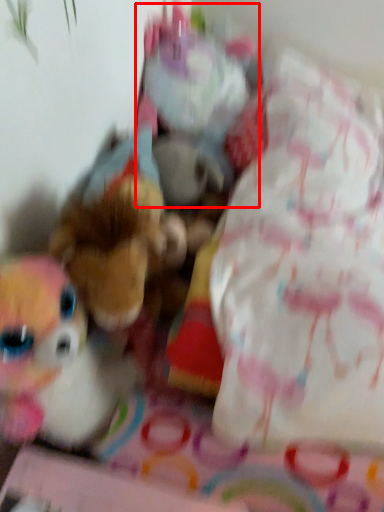
Question: From the image's perspective, considering the relative positions of toy (annotated by the red box) and toy in the image provided, where is toy (annotated by the red box) located with respect to the staircase?

Choices:
 (A) above
 (B) below

Answer: (A)